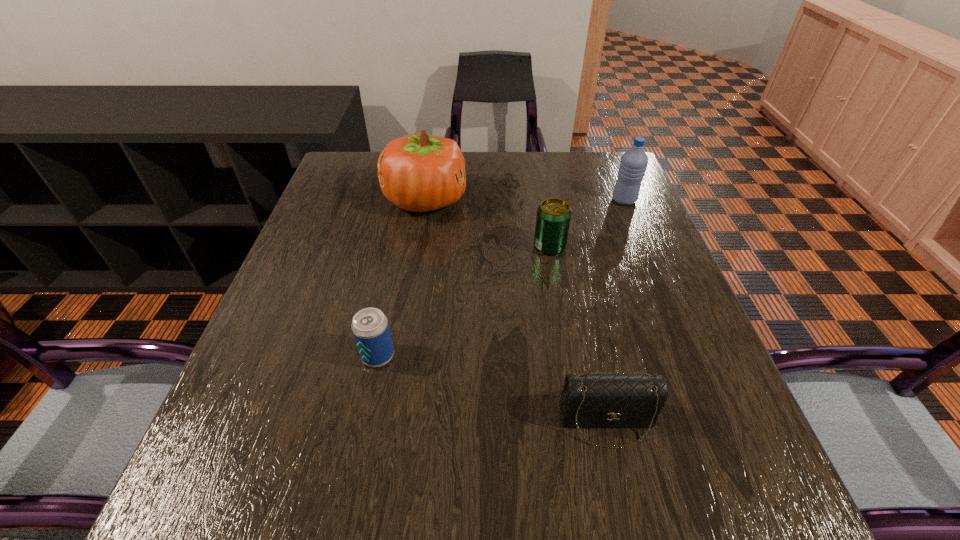
Find the location of a particular element. blank space located on the back of the fourth farthest object is located at coordinates (402, 236).

I want to click on free space located on the front flap of the clutch bag, so click(622, 487).

Where is `pumpkin present at the far edge`? Image resolution: width=960 pixels, height=540 pixels. pumpkin present at the far edge is located at coordinates (419, 172).

The width and height of the screenshot is (960, 540). I want to click on water bottle positioned at the far edge, so click(x=633, y=164).

The image size is (960, 540). Find the location of `water bottle that is at the right edge`. water bottle that is at the right edge is located at coordinates (633, 164).

At what (x,y) coordinates should I click in order to perform the action: click on clutch bag present at the right edge. Please return your answer as a coordinate pair (x, y). The width and height of the screenshot is (960, 540). Looking at the image, I should click on (593, 400).

At what (x,y) coordinates should I click in order to perform the action: click on object positioned at the far right corner. Please return your answer as a coordinate pair (x, y). The height and width of the screenshot is (540, 960). Looking at the image, I should click on (633, 164).

Image resolution: width=960 pixels, height=540 pixels. Identify the location of free space at the far edge. (546, 172).

Where is `vacant space at the near edge of the desktop`? This screenshot has height=540, width=960. vacant space at the near edge of the desktop is located at coordinates (329, 497).

Identify the location of free space at the left edge of the desktop. This screenshot has width=960, height=540. (322, 305).